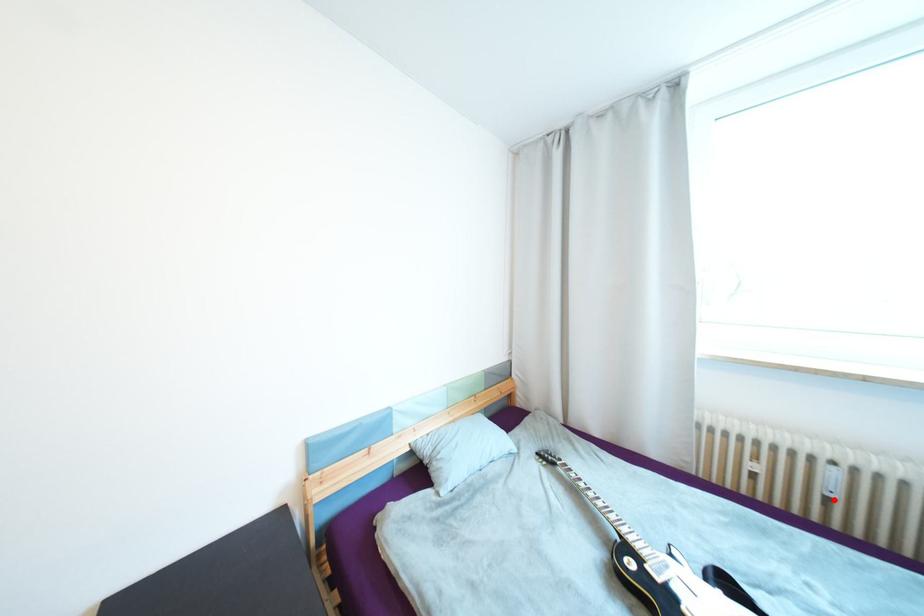
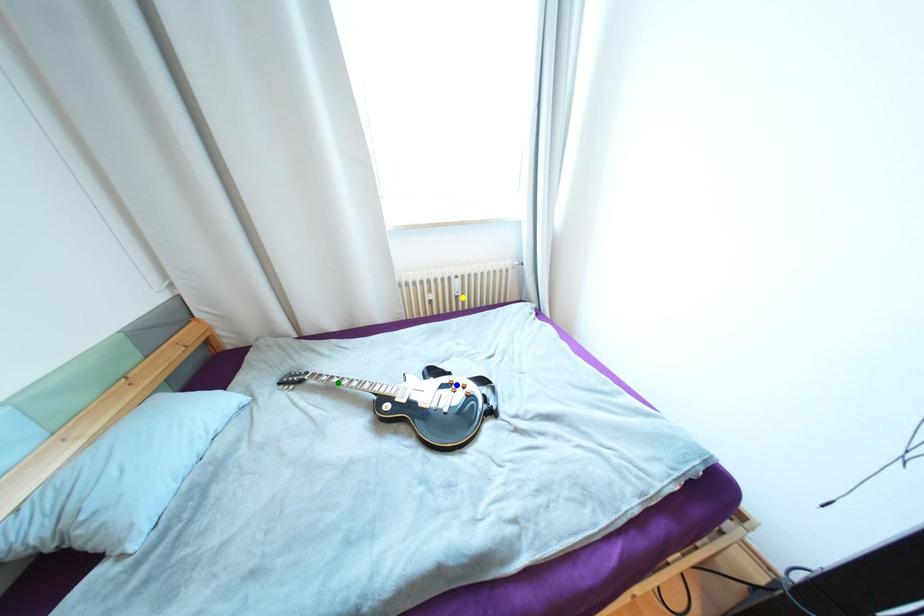
Question: I am providing you with two images of the same scene from different viewpoints. A red point is marked on the first image. You are given multiple points on the second image. Which spot in image 2 lines up with the point in image 1?

Choices:
 (A) blue point
 (B) green point
 (C) yellow point

Answer: (C)